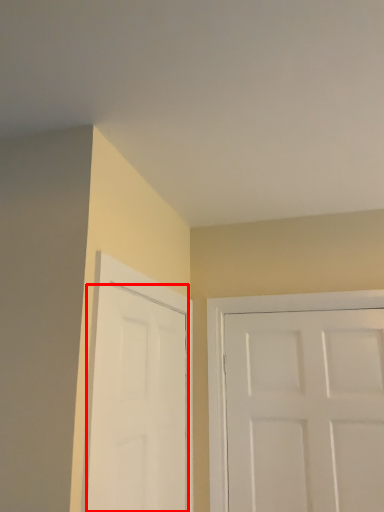
Question: Where is door (annotated by the red box) located in relation to door in the image?

Choices:
 (A) right
 (B) left

Answer: (B)